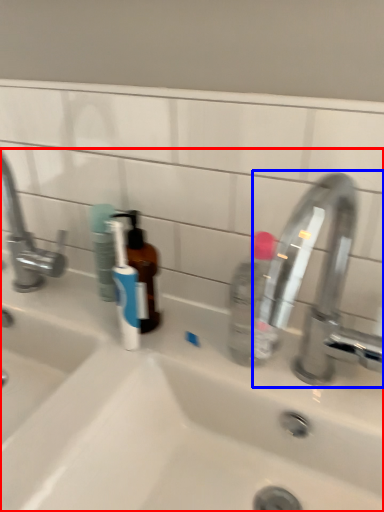
Question: Which object is closer to the camera taking this photo, sink (highlighted by a red box) or tap (highlighted by a blue box)?

Choices:
 (A) sink
 (B) tap

Answer: (A)